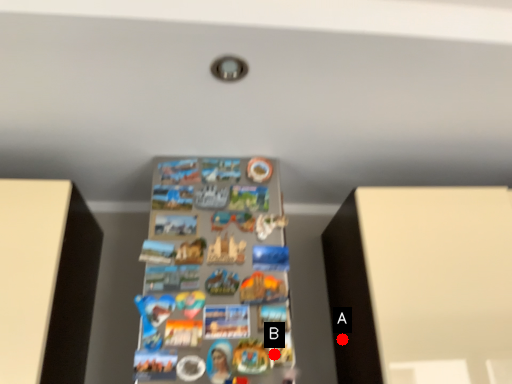
Question: Two points are circled on the image, labeled by A and B beside each circle. Among these points, which one is farthest from the camera?

Choices:
 (A) A is further
 (B) B is further

Answer: (A)